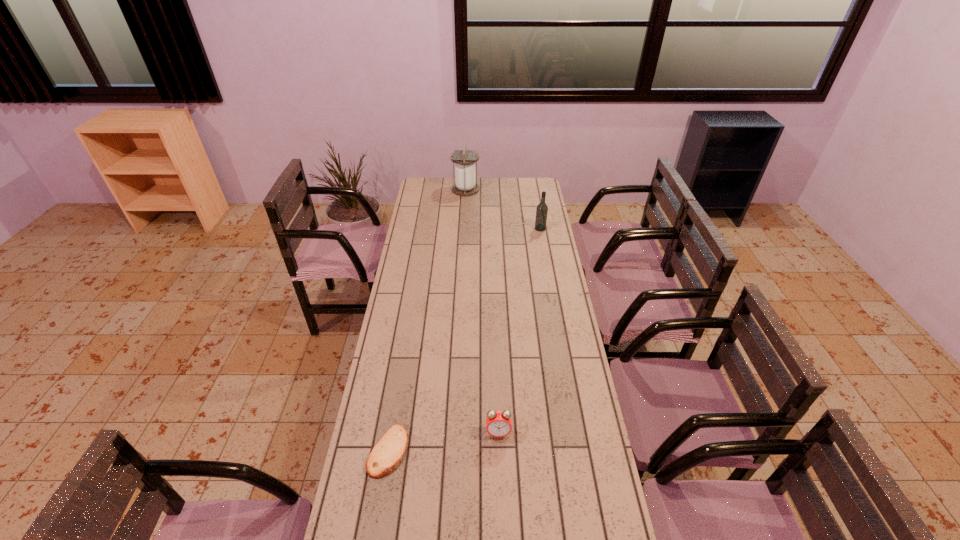
This screenshot has height=540, width=960. Identify the location of the farthest object. (465, 184).

I want to click on the tallest object, so click(465, 184).

Locate an element on the screen. The image size is (960, 540). the third shortest object is located at coordinates point(542,209).

This screenshot has height=540, width=960. Identify the location of the second farthest object. (542, 209).

Locate an element on the screen. This screenshot has height=540, width=960. the second shortest object is located at coordinates pyautogui.click(x=498, y=423).

Where is `the second object from right to left`? the second object from right to left is located at coordinates (498, 423).

Image resolution: width=960 pixels, height=540 pixels. In order to click on pita bread in this screenshot , I will do `click(389, 451)`.

At what (x,y) coordinates should I click in order to perform the action: click on the shortest object. Please return your answer as a coordinate pair (x, y). Image resolution: width=960 pixels, height=540 pixels. Looking at the image, I should click on (389, 451).

Identify the location of free space located on the right of the lantern. This screenshot has height=540, width=960. (518, 190).

What are the coordinates of `free space located 0.260m on the front of the second farthest object` in the screenshot? It's located at (546, 264).